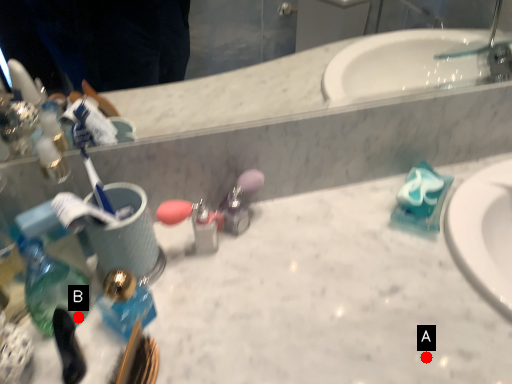
Question: Two points are circled on the image, labeled by A and B beside each circle. Among these points, which one is nearest to the camera?

Choices:
 (A) A is closer
 (B) B is closer

Answer: (A)